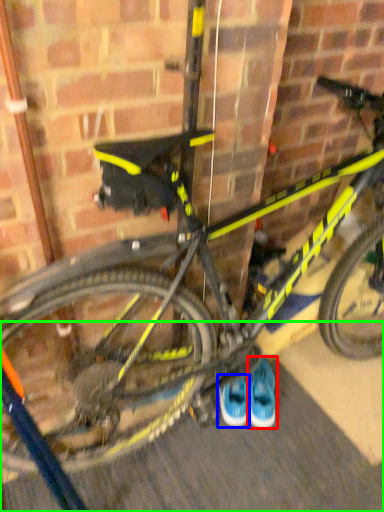
Question: Which object is the farthest from footwear (highlighted by a red box)? Choose among these: footwear (highlighted by a blue box) or pavement (highlighted by a green box).

Choices:
 (A) footwear
 (B) pavement

Answer: (B)